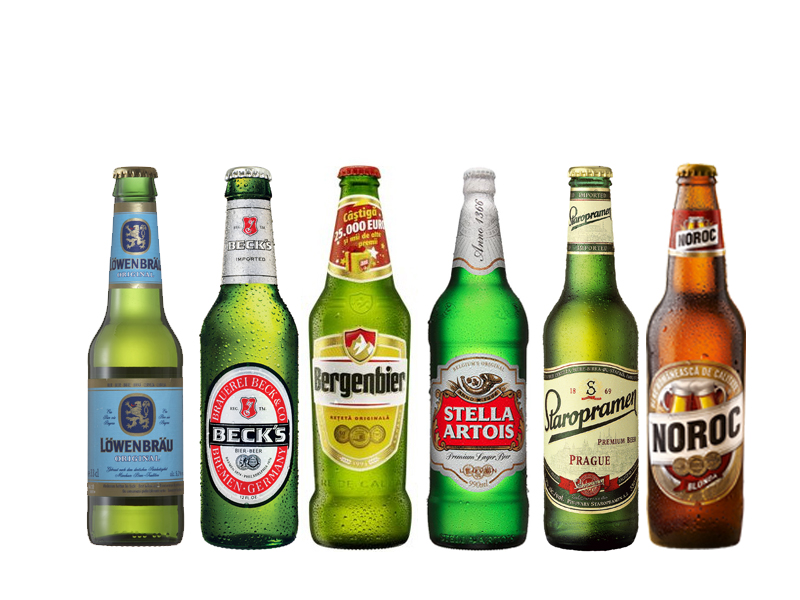
Identify the location of beer bottles. (140, 331), (238, 336), (373, 315), (485, 321), (590, 327), (690, 329).